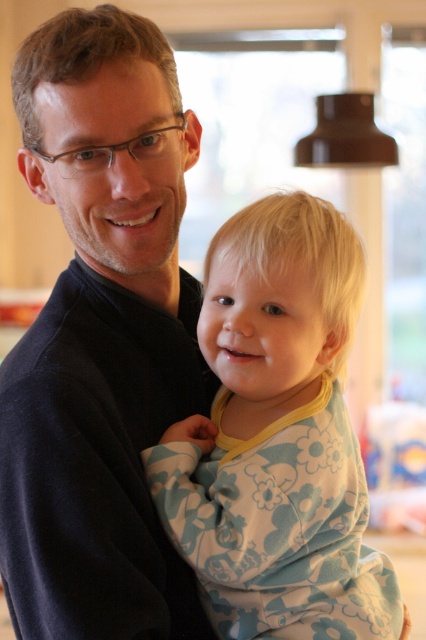
You are taking a photo of two points in the scene. The first point is labeled as point (68, 209) and the second is point (175, 515). Which point is closer to the camera?

Point (68, 209) is closer to the camera than point (175, 515) because it is further to the camera than the latter.

You are a photographer trying to capture a closeup of the dark blue sweater at center and the fluffy cotton onesie at center. Since both are at the center, which one will be in focus if you focus on the one closer to the camera?

The dark blue sweater at center will be in focus because it is in front of the fluffy cotton onesie at center, making it closer to the camera.